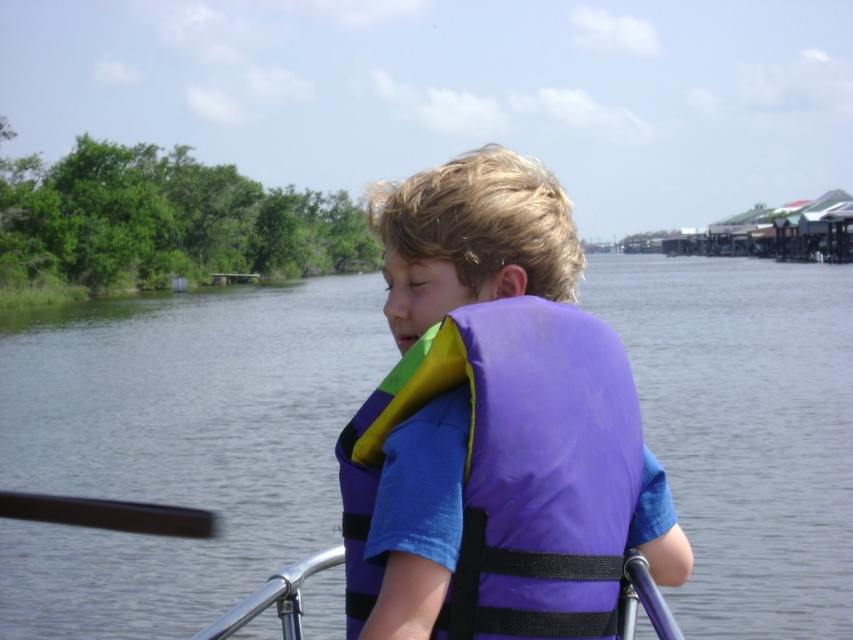
Does purple life vest at center have a lesser height compared to purple fabric life vest at center?

Incorrect, purple life vest at center's height does not fall short of purple fabric life vest at center's.

Between purple life vest at center and purple fabric life vest at center, which one is positioned lower?

purple fabric life vest at center is below.

At what (x,y) coordinates should I click in order to perform the action: click on purple life vest at center. Please return your answer as a coordinate pair (x, y). This screenshot has height=640, width=853. Looking at the image, I should click on (178, 444).